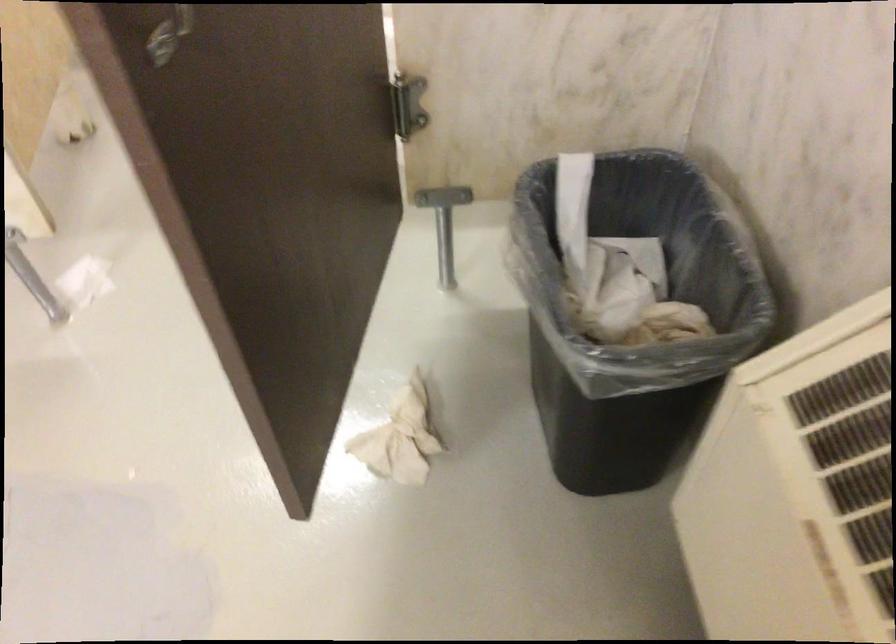
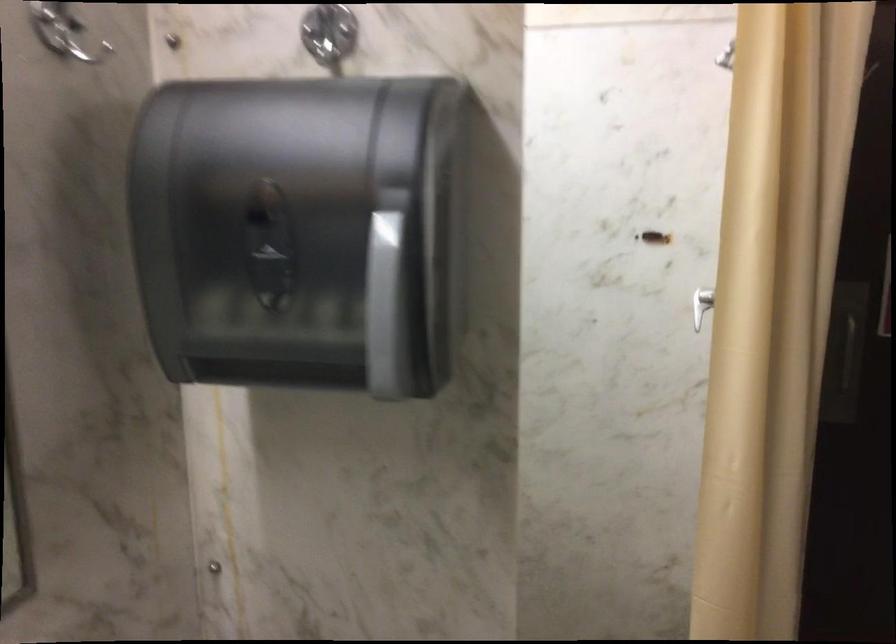
The first image is from the beginning of the video and the second image is from the end. How did the camera likely rotate when shooting the video?

The camera's rotation is toward left-down.